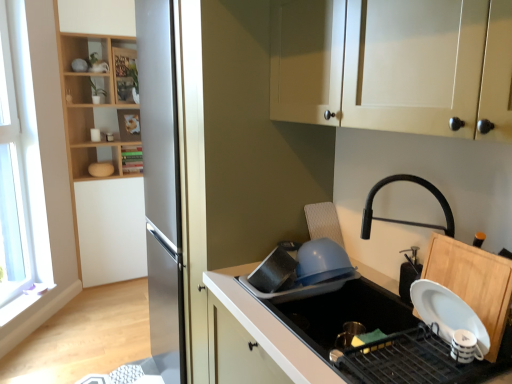
What do you see at coordinates (302, 272) in the screenshot? Image resolution: width=512 pixels, height=384 pixels. I see `matte blue bowl at center, arranged as the 2th appliance when viewed from the right` at bounding box center [302, 272].

You are a GUI agent. You are given a task and a screenshot of the screen. Output one action in this format:
    pyautogui.click(x=<x>, y=<y>)
    Task: Click on the white matte countertop at lower right
    The width and height of the screenshot is (512, 384).
    Given the screenshot: What is the action you would take?
    pyautogui.click(x=267, y=328)

The width and height of the screenshot is (512, 384). Describe the element at coordinates (267, 328) in the screenshot. I see `white matte countertop at lower right` at that location.

Measure the distance between green matte bookshelf at upper left, the 1th shelf ordered from the bottom, and camera.

green matte bookshelf at upper left, the 1th shelf ordered from the bottom, is 3.45 meters away from camera.

I want to click on light wood/wooden shelves at upper left, which is the first shelf in top-to-bottom order, so tap(95, 105).

Where is `wooden bookshelf at upper left, which ranks as the 2th shelf in top-to-bottom order`? wooden bookshelf at upper left, which ranks as the 2th shelf in top-to-bottom order is located at coordinates (129, 125).

Is white matte cabinet at upper center oriented towards matte blue bowl at center, the 1th appliance positioned from the left?

No, white matte cabinet at upper center is not aimed at matte blue bowl at center, the 1th appliance positioned from the left.

Locate an element on the screen. cabinetry above the matte blue bowl at center, the 1th appliance positioned from the left (from a real-world perspective) is located at coordinates (392, 64).

Does white matte cabinet at upper center have a lesser height compared to matte blue bowl at center, the 1th appliance positioned from the left?

No.

Can you tell me how much white matte cabinet at upper center and matte blue bowl at center, arranged as the 2th appliance when viewed from the right, differ in facing direction?

There is a 90-degree angle between the facing directions of white matte cabinet at upper center and matte blue bowl at center, arranged as the 2th appliance when viewed from the right.

Can you confirm if green matte bookshelf at upper left, which appears as the third shelf when viewed from the top, is positioned to the right of light wood/wooden shelves at upper left, the third shelf when ordered from bottom to top?

Yes.

Does green matte bookshelf at upper left, which appears as the third shelf when viewed from the top, have a lesser width compared to light wood/wooden shelves at upper left, which is the first shelf in top-to-bottom order?

Indeed, green matte bookshelf at upper left, which appears as the third shelf when viewed from the top, has a lesser width compared to light wood/wooden shelves at upper left, which is the first shelf in top-to-bottom order.

Is green matte bookshelf at upper left, the 1th shelf ordered from the bottom, shorter than light wood/wooden shelves at upper left, the third shelf when ordered from bottom to top?

Yes, green matte bookshelf at upper left, the 1th shelf ordered from the bottom, is shorter than light wood/wooden shelves at upper left, the third shelf when ordered from bottom to top.

Is point (133, 147) positioned before point (116, 76)?

No, it is behind (116, 76).

Which of these two, light wood/wooden shelves at upper left, which is the first shelf in top-to-bottom order, or wooden bookshelf at upper left, which ranks as the 2th shelf in top-to-bottom order, is bigger?

Bigger between the two is light wood/wooden shelves at upper left, which is the first shelf in top-to-bottom order.

Can you confirm if light wood/wooden shelves at upper left, which is the first shelf in top-to-bottom order, is shorter than wooden bookshelf at upper left, which ranks as the 2th shelf in top-to-bottom order?

In fact, light wood/wooden shelves at upper left, which is the first shelf in top-to-bottom order, may be taller than wooden bookshelf at upper left, which ranks as the 2th shelf in top-to-bottom order.

Is light wood/wooden shelves at upper left, which is the first shelf in top-to-bottom order, positioned with its back to wooden bookshelf at upper left, which ranks as the 2th shelf in top-to-bottom order?

Yes.

Which object is thinner, light wood/wooden shelves at upper left, which is the first shelf in top-to-bottom order, or wooden bookshelf at upper left, which ranks as the 2th shelf in top-to-bottom order?

wooden bookshelf at upper left, which ranks as the 2th shelf in top-to-bottom order, is thinner.

Considering the sizes of objects matte blue bowl at center, the 1th appliance positioned from the left, and transparent glass window at left in the image provided, who is bigger, matte blue bowl at center, the 1th appliance positioned from the left, or transparent glass window at left?

transparent glass window at left is bigger.

You are a GUI agent. You are given a task and a screenshot of the screen. Output one action in this format:
    pyautogui.click(x=<x>, y=<y>)
    Task: Click on the window above the matte blue bowl at center, the 1th appliance positioned from the left (from a real-world perspective)
    This screenshot has width=512, height=384.
    Given the screenshot: What is the action you would take?
    pyautogui.click(x=20, y=163)

From the image's perspective, is matte blue bowl at center, arranged as the 2th appliance when viewed from the right, located above or below transparent glass window at left?

matte blue bowl at center, arranged as the 2th appliance when viewed from the right, is situated lower than transparent glass window at left in the image.

Is green matte bookshelf at upper left, the 1th shelf ordered from the bottom, facing away from white matte countertop at lower right?

No, green matte bookshelf at upper left, the 1th shelf ordered from the bottom,'s orientation is not away from white matte countertop at lower right.

Can you confirm if green matte bookshelf at upper left, the 1th shelf ordered from the bottom, is taller than white matte countertop at lower right?

No, green matte bookshelf at upper left, the 1th shelf ordered from the bottom, is not taller than white matte countertop at lower right.

Is green matte bookshelf at upper left, the 1th shelf ordered from the bottom, bigger than white matte countertop at lower right?

Incorrect, green matte bookshelf at upper left, the 1th shelf ordered from the bottom, is not larger than white matte countertop at lower right.

Can you confirm if green matte bookshelf at upper left, the 1th shelf ordered from the bottom, is positioned to the left of white matte countertop at lower right?

Yes, green matte bookshelf at upper left, the 1th shelf ordered from the bottom, is to the left of white matte countertop at lower right.

Which of these two, transparent glass window at left or light wood/wooden shelves at upper left, which is the first shelf in top-to-bottom order, is thinner?

Thinner between the two is transparent glass window at left.

Between transparent glass window at left and light wood/wooden shelves at upper left, which is the first shelf in top-to-bottom order, which one is positioned in front?

transparent glass window at left is more forward.

From the image's perspective, is transparent glass window at left above or below light wood/wooden shelves at upper left, the third shelf when ordered from bottom to top?

From the image's perspective, transparent glass window at left appears below light wood/wooden shelves at upper left, the third shelf when ordered from bottom to top.

Choose the correct answer: Is white matte countertop at lower right inside transparent glass window at left or outside it?

white matte countertop at lower right cannot be found inside transparent glass window at left.

Is white matte countertop at lower right oriented away from transparent glass window at left?

No, white matte countertop at lower right is not facing the opposite direction of transparent glass window at left.

Is white matte countertop at lower right to the left or to the right of transparent glass window at left in the image?

Based on their positions, white matte countertop at lower right is located to the right of transparent glass window at left.

From a real-world perspective, is white matte countertop at lower right under transparent glass window at left?

Yes, from a real-world perspective, white matte countertop at lower right is below transparent glass window at left.

Identify the location of cabinetry above the matte blue bowl at center, the 1th appliance positioned from the left (from the image's perspective). The height and width of the screenshot is (384, 512). (392, 64).

This screenshot has width=512, height=384. I want to click on the 2nd shelf below the light wood/wooden shelves at upper left, which is the first shelf in top-to-bottom order (from the image's perspective), so [x=132, y=158].

Considering their positions, is black matte soap dispenser at right, placed as the 2th appliance when sorted from left to right, positioned further to wooden bookshelf at upper left, the 2th shelf from the bottom, than light wood/wooden shelves at upper left, the third shelf when ordered from bottom to top?

The object further to wooden bookshelf at upper left, the 2th shelf from the bottom, is black matte soap dispenser at right, placed as the 2th appliance when sorted from left to right.

Considering their positions, is transparent glass window at left positioned closer to white matte countertop at lower right than wooden bookshelf at upper left, the 2th shelf from the bottom?

transparent glass window at left is closer to white matte countertop at lower right.

When comparing their distances from transparent glass window at left, does white matte countertop at lower right or wooden bookshelf at upper left, the 2th shelf from the bottom, seem closer?

Based on the image, wooden bookshelf at upper left, the 2th shelf from the bottom, appears to be nearer to transparent glass window at left.

Considering their positions, is transparent glass window at left positioned closer to green matte bookshelf at upper left, the 1th shelf ordered from the bottom, than matte blue bowl at center, the 1th appliance positioned from the left?

transparent glass window at left lies closer to green matte bookshelf at upper left, the 1th shelf ordered from the bottom, than the other object.

Which object lies further to the anchor point white matte cabinet at upper center, matte blue bowl at center, arranged as the 2th appliance when viewed from the right, or green matte bookshelf at upper left, which appears as the third shelf when viewed from the top?

green matte bookshelf at upper left, which appears as the third shelf when viewed from the top.

Estimate the real-world distances between objects in this image. Which object is further from light wood/wooden shelves at upper left, which is the first shelf in top-to-bottom order, white matte countertop at lower right or white matte cabinet at upper center?

Among the two, white matte cabinet at upper center is located further to light wood/wooden shelves at upper left, which is the first shelf in top-to-bottom order.

Based on their spatial positions, is black matte soap dispenser at right, the 1th appliance positioned from the right, or light wood/wooden shelves at upper left, the third shelf when ordered from bottom to top, further from matte blue bowl at center, arranged as the 2th appliance when viewed from the right?

light wood/wooden shelves at upper left, the third shelf when ordered from bottom to top.

Considering their positions, is matte blue bowl at center, the 1th appliance positioned from the left, positioned closer to transparent glass window at left than green matte bookshelf at upper left, which appears as the third shelf when viewed from the top?

green matte bookshelf at upper left, which appears as the third shelf when viewed from the top, is closer to transparent glass window at left.

Find the location of a particular element. The width and height of the screenshot is (512, 384). shelf between white matte cabinet at upper center and wooden bookshelf at upper left, the 2th shelf from the bottom, from front to back is located at coordinates (95, 105).

Identify the location of shelf positioned between transparent glass window at left and wooden bookshelf at upper left, the 2th shelf from the bottom, from near to far. (95, 105).

Identify the location of window located between matte blue bowl at center, arranged as the 2th appliance when viewed from the right, and green matte bookshelf at upper left, which appears as the third shelf when viewed from the top, in the depth direction. (20, 163).

The width and height of the screenshot is (512, 384). Find the location of `countertop located between white matte cabinet at upper center and green matte bookshelf at upper left, the 1th shelf ordered from the bottom, in the depth direction`. countertop located between white matte cabinet at upper center and green matte bookshelf at upper left, the 1th shelf ordered from the bottom, in the depth direction is located at coordinates (267, 328).